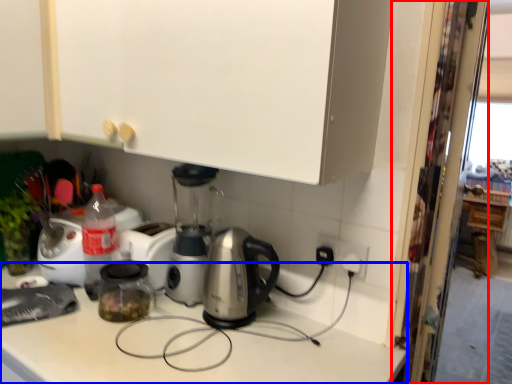
Question: Which object appears closest to the camera in this image, screen door (highlighted by a red box) or counter top (highlighted by a blue box)?

Choices:
 (A) screen door
 (B) counter top

Answer: (B)